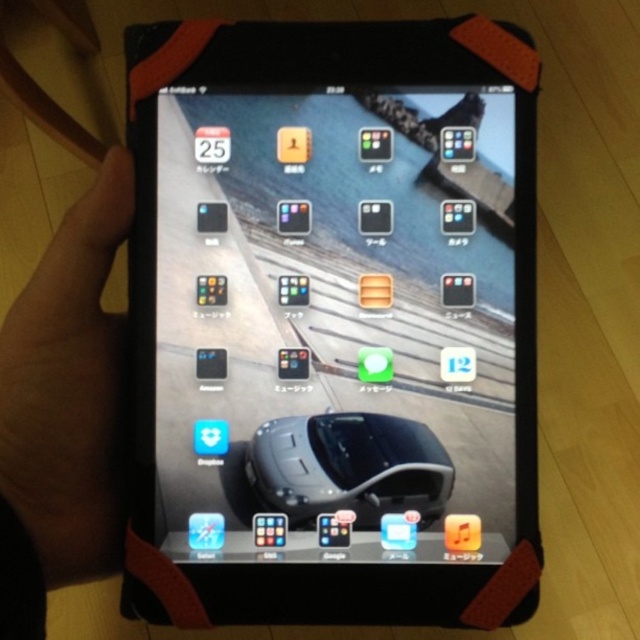
Question: Considering the real-world distances, which object is farthest from the satin black mouse at center?

Choices:
 (A) black plastic tablet at center
 (B) dark skin at lower left

Answer: (B)

Question: Which object appears farthest from the camera in this image?

Choices:
 (A) dark skin at lower left
 (B) satin black mouse at center

Answer: (B)

Question: Is dark skin at lower left behind satin black mouse at center?

Choices:
 (A) yes
 (B) no

Answer: (B)

Question: Considering the real-world distances, which object is closest to the dark skin at lower left?

Choices:
 (A) black plastic tablet at center
 (B) satin black mouse at center

Answer: (A)

Question: Does black plastic tablet at center appear over dark skin at lower left?

Choices:
 (A) no
 (B) yes

Answer: (B)

Question: Can you confirm if black plastic tablet at center is positioned to the right of satin black mouse at center?

Choices:
 (A) yes
 (B) no

Answer: (B)